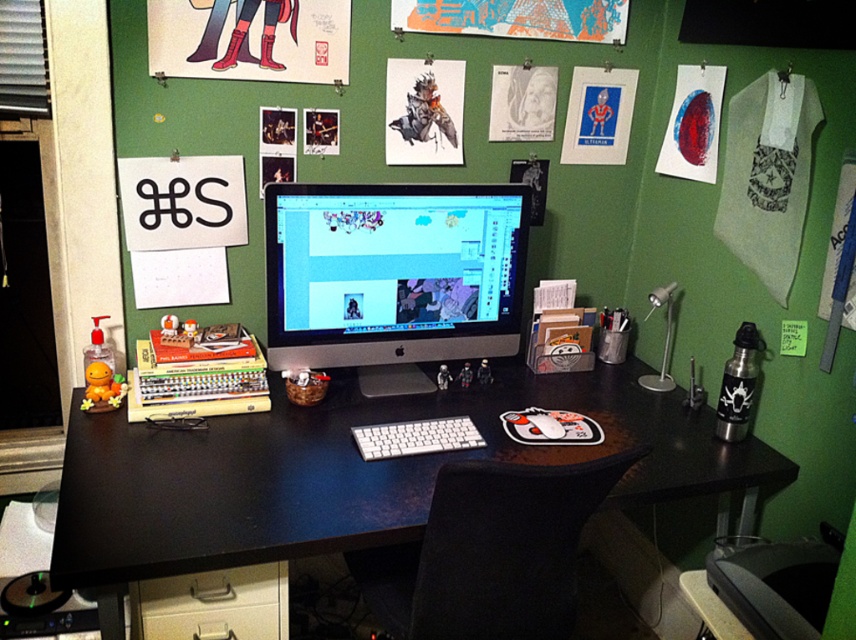
Question: Observing the image, what is the correct spatial positioning of black matte computer desk at center in reference to satin silver monitor at center?

Choices:
 (A) left
 (B) right

Answer: (B)

Question: From the image, what is the correct spatial relationship of black matte computer desk at center in relation to satin silver monitor at center?

Choices:
 (A) right
 (B) left

Answer: (A)

Question: Which point is closer to the camera?

Choices:
 (A) (290, 188)
 (B) (372, 456)
 (C) (257, 452)

Answer: (B)

Question: Which object appears farthest from the camera in this image?

Choices:
 (A) white plastic keyboard at center
 (B) satin silver monitor at center

Answer: (B)

Question: Considering the relative positions of black matte computer desk at center and satin silver monitor at center in the image provided, where is black matte computer desk at center located with respect to satin silver monitor at center?

Choices:
 (A) below
 (B) above

Answer: (A)

Question: Which point is farther to the camera?

Choices:
 (A) satin silver monitor at center
 (B) black matte computer desk at center
 (C) white plastic keyboard at center

Answer: (A)